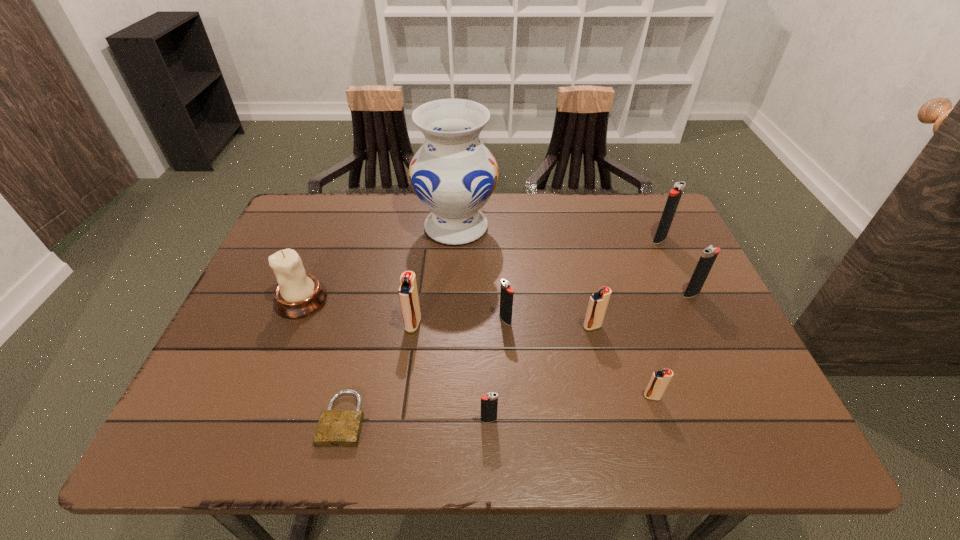
Locate an element on the screen. The height and width of the screenshot is (540, 960). vacant region at the near left corner of the desktop is located at coordinates (269, 414).

Where is `vacant region at the far right corner of the desktop`? The height and width of the screenshot is (540, 960). vacant region at the far right corner of the desktop is located at coordinates (659, 201).

Where is `free space at the near right corner of the desktop`? Image resolution: width=960 pixels, height=540 pixels. free space at the near right corner of the desktop is located at coordinates (742, 438).

Find the location of `empty space between the leftmost red igniter and the white candle holder`. empty space between the leftmost red igniter and the white candle holder is located at coordinates (357, 312).

Locate an element on the screen. The width and height of the screenshot is (960, 540). vacant space that's between the biggest red igniter and the fourth object from right to left is located at coordinates (503, 325).

Find the location of `free space between the third biggest black igniter and the leftmost black igniter`. free space between the third biggest black igniter and the leftmost black igniter is located at coordinates (497, 370).

Where is `empty location between the white candle holder and the third nearest black igniter`? empty location between the white candle holder and the third nearest black igniter is located at coordinates (496, 297).

This screenshot has height=540, width=960. Identify the location of free spot between the leftmost red igniter and the nearest igniter. [451, 372].

Identify the location of vacant area between the second biggest red igniter and the padlock. The image size is (960, 540). (468, 373).

Locate an element on the screen. This screenshot has height=540, width=960. free spot between the second black igniter from left to right and the tallest object is located at coordinates (481, 273).